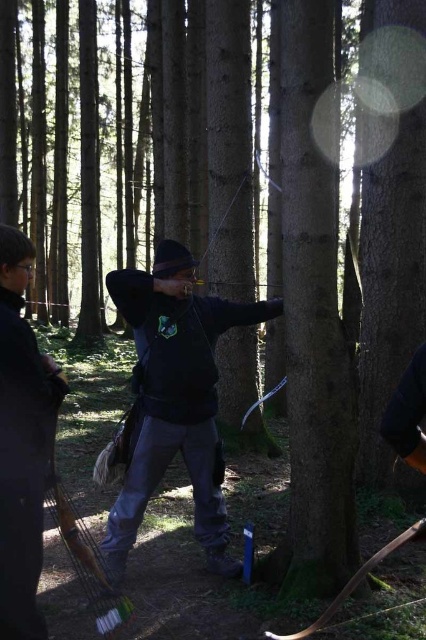
Based on the photo, who is higher up, dark blue fabric jacket at center or black matte jacket at center?

black matte jacket at center is above.

Does dark blue fabric jacket at center have a lesser height compared to black matte jacket at center?

No, dark blue fabric jacket at center is not shorter than black matte jacket at center.

The image size is (426, 640). What do you see at coordinates (175, 397) in the screenshot?
I see `dark blue fabric jacket at center` at bounding box center [175, 397].

Identify the location of dark blue fabric jacket at center. Image resolution: width=426 pixels, height=640 pixels. (175, 397).